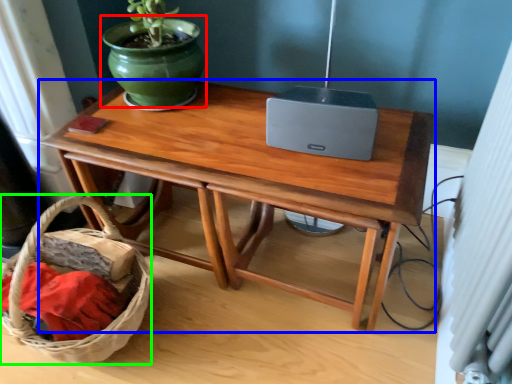
Question: Estimate the real-world distances between objects in this image. Which object is closer to flowerpot (highlighted by a red box), table (highlighted by a blue box) or basket (highlighted by a green box)?

Choices:
 (A) table
 (B) basket

Answer: (A)